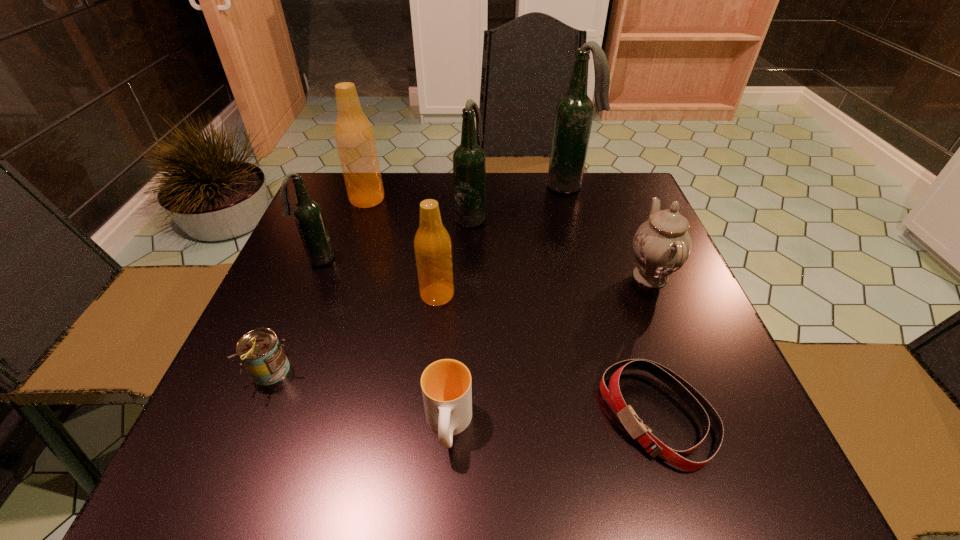
The width and height of the screenshot is (960, 540). I want to click on chinaware, so click(x=661, y=245).

The height and width of the screenshot is (540, 960). In order to click on can in this screenshot , I will do `click(261, 352)`.

The height and width of the screenshot is (540, 960). In order to click on yellow cup in this screenshot , I will do (446, 386).

You are a GUI agent. You are given a task and a screenshot of the screen. Output one action in this format:
    pyautogui.click(x=<x>, y=<y>)
    Task: Click on the eighth tallest object
    Image resolution: width=960 pixels, height=540 pixels.
    Given the screenshot: What is the action you would take?
    pyautogui.click(x=446, y=386)

At what (x,y) coordinates should I click in order to perform the action: click on dog collar. Please return your answer as a coordinate pair (x, y). Looking at the image, I should click on (706, 414).

At what (x,y) coordinates should I click in order to perform the action: click on pink dog collar. Please return your answer as a coordinate pair (x, y). Image resolution: width=960 pixels, height=540 pixels. Looking at the image, I should click on (706, 414).

Locate an element on the screen. The image size is (960, 540). vacant position located 0.230m on the front of the rightmost beer bottle is located at coordinates (587, 249).

Find the location of a particular element. This screenshot has height=540, width=960. vacant space located on the left of the bigger tan beer bottle is located at coordinates (327, 199).

Locate an element on the screen. free spot located 0.250m on the right of the second farthest dark beer bottle is located at coordinates (583, 217).

The image size is (960, 540). Find the location of `vacant space located on the front of the second nearest beer bottle`. vacant space located on the front of the second nearest beer bottle is located at coordinates point(270,380).